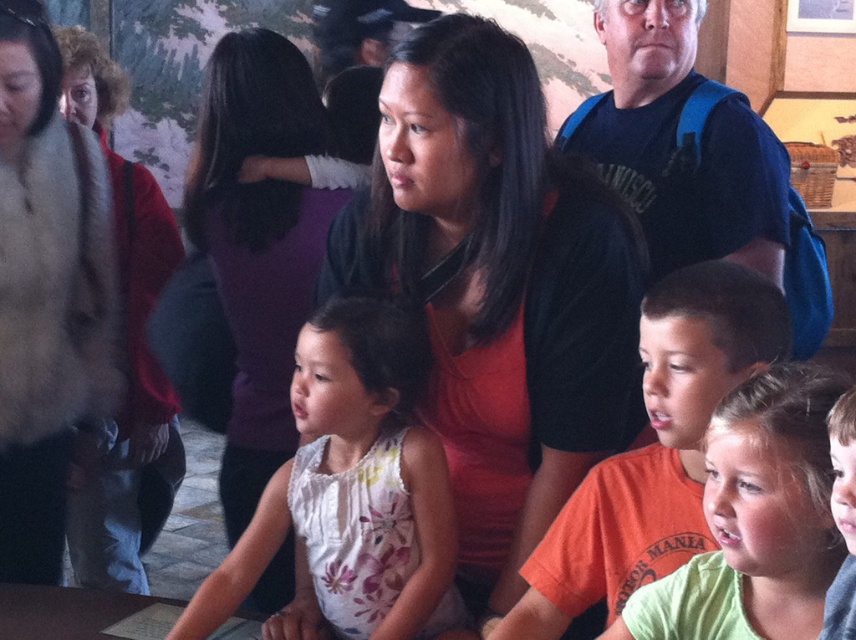
Is matte black shirt at center behind red sweater at left?

No, matte black shirt at center is closer to the viewer.

Between matte black shirt at center and red sweater at left, which one has more height?

red sweater at left is taller.

Find the location of a particular element. The image size is (856, 640). matte black shirt at center is located at coordinates (497, 288).

Does matte brown fur coat at left appear on the right side of orange cotton shirt at center?

Incorrect, matte brown fur coat at left is not on the right side of orange cotton shirt at center.

What do you see at coordinates (46, 292) in the screenshot? I see `matte brown fur coat at left` at bounding box center [46, 292].

The height and width of the screenshot is (640, 856). I want to click on matte brown fur coat at left, so click(46, 292).

Does white floral dress at center come in front of purple fabric at center?

Yes, white floral dress at center is in front of purple fabric at center.

The height and width of the screenshot is (640, 856). Describe the element at coordinates (352, 488) in the screenshot. I see `white floral dress at center` at that location.

The height and width of the screenshot is (640, 856). In order to click on white floral dress at center in this screenshot , I will do `click(352, 488)`.